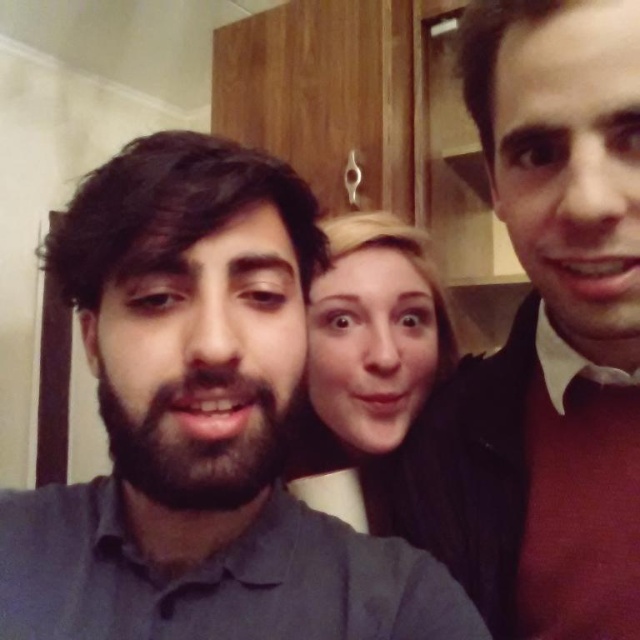
Based on the photo, does dark gray shirt at left appear over smooth blonde hair at center?

No, dark gray shirt at left is not above smooth blonde hair at center.

Can you confirm if dark gray shirt at left is smaller than smooth blonde hair at center?

Actually, dark gray shirt at left might be larger than smooth blonde hair at center.

Which is behind, point (266, 182) or point (330, 266)?

The point (330, 266) is behind.

In order to click on dark gray shirt at left in this screenshot , I will do `click(200, 426)`.

Is burgundy sweater at right wider than smooth blonde hair at center?

Incorrect, burgundy sweater at right's width does not surpass smooth blonde hair at center's.

Between burgundy sweater at right and smooth blonde hair at center, which one has less height?

With less height is smooth blonde hair at center.

The width and height of the screenshot is (640, 640). I want to click on burgundy sweater at right, so click(544, 337).

Does dark gray shirt at left have a greater height compared to burgundy sweater at right?

Incorrect, dark gray shirt at left's height is not larger of burgundy sweater at right's.

Between dark gray shirt at left and burgundy sweater at right, which one appears on the right side from the viewer's perspective?

burgundy sweater at right

Which is behind, point (289, 396) or point (570, 353)?

Positioned behind is point (570, 353).

Find the location of a particular element. This screenshot has width=640, height=640. dark gray shirt at left is located at coordinates (200, 426).